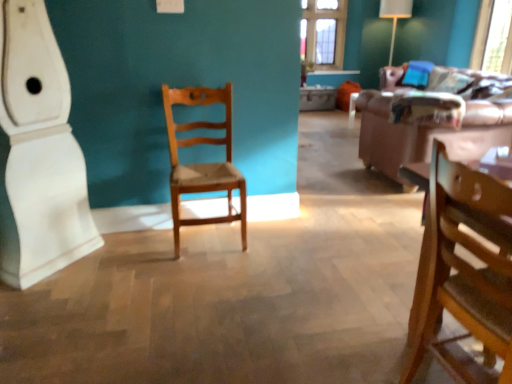
Question: Is transparent glass window screen at upper right surrounded by white glossy baseboard at left?

Choices:
 (A) yes
 (B) no

Answer: (B)

Question: Considering the relative positions of white glossy baseboard at left and transparent glass window screen at upper right in the image provided, is white glossy baseboard at left to the left of transparent glass window screen at upper right from the viewer's perspective?

Choices:
 (A) yes
 (B) no

Answer: (A)

Question: From the image's perspective, does white glossy baseboard at left appear lower than transparent glass window screen at upper right?

Choices:
 (A) yes
 (B) no

Answer: (A)

Question: Considering the relative sizes of white glossy baseboard at left and transparent glass window screen at upper right in the image provided, is white glossy baseboard at left wider than transparent glass window screen at upper right?

Choices:
 (A) yes
 (B) no

Answer: (A)

Question: From the image's perspective, is white glossy baseboard at left located above transparent glass window screen at upper right?

Choices:
 (A) yes
 (B) no

Answer: (B)

Question: Is white glossy baseboard at left looking in the opposite direction of transparent glass window screen at upper right?

Choices:
 (A) no
 (B) yes

Answer: (A)

Question: Considering the relative sizes of transparent glass window screen at upper right and white glossy baseboard at left in the image provided, is transparent glass window screen at upper right wider than white glossy baseboard at left?

Choices:
 (A) no
 (B) yes

Answer: (A)

Question: Does transparent glass window screen at upper right have a larger size compared to white glossy baseboard at left?

Choices:
 (A) no
 (B) yes

Answer: (A)

Question: From the image's perspective, is transparent glass window screen at upper right located above white glossy baseboard at left?

Choices:
 (A) no
 (B) yes

Answer: (B)

Question: Is white glossy baseboard at left completely or partially inside transparent glass window screen at upper right?

Choices:
 (A) no
 (B) yes

Answer: (A)

Question: Considering the relative sizes of transparent glass window screen at upper right and white glossy baseboard at left in the image provided, is transparent glass window screen at upper right thinner than white glossy baseboard at left?

Choices:
 (A) yes
 (B) no

Answer: (A)

Question: Is transparent glass window screen at upper right further to camera compared to white glossy baseboard at left?

Choices:
 (A) yes
 (B) no

Answer: (A)

Question: Is brown leather couch at right with transparent glass window screen at upper right?

Choices:
 (A) no
 (B) yes

Answer: (A)